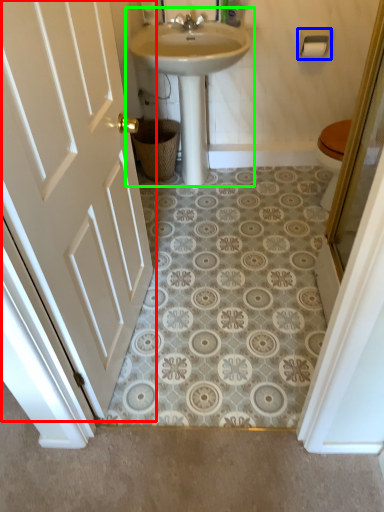
Question: Which object is the farthest from door (highlighted by a red box)? Choose among these: towel bar (highlighted by a blue box) or sink (highlighted by a green box).

Choices:
 (A) towel bar
 (B) sink

Answer: (A)